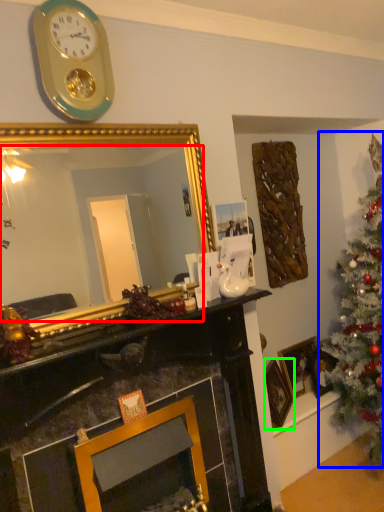
Question: Estimate the real-world distances between objects in this image. Which object is closer to mirror (highlighted by a red box), christmas tree (highlighted by a blue box) or picture frame (highlighted by a green box)?

Choices:
 (A) christmas tree
 (B) picture frame

Answer: (A)